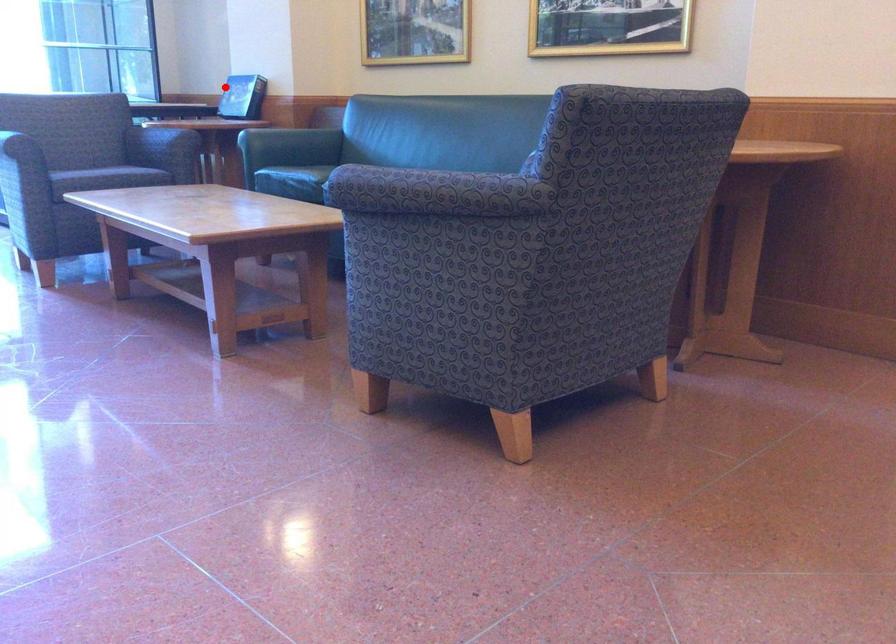
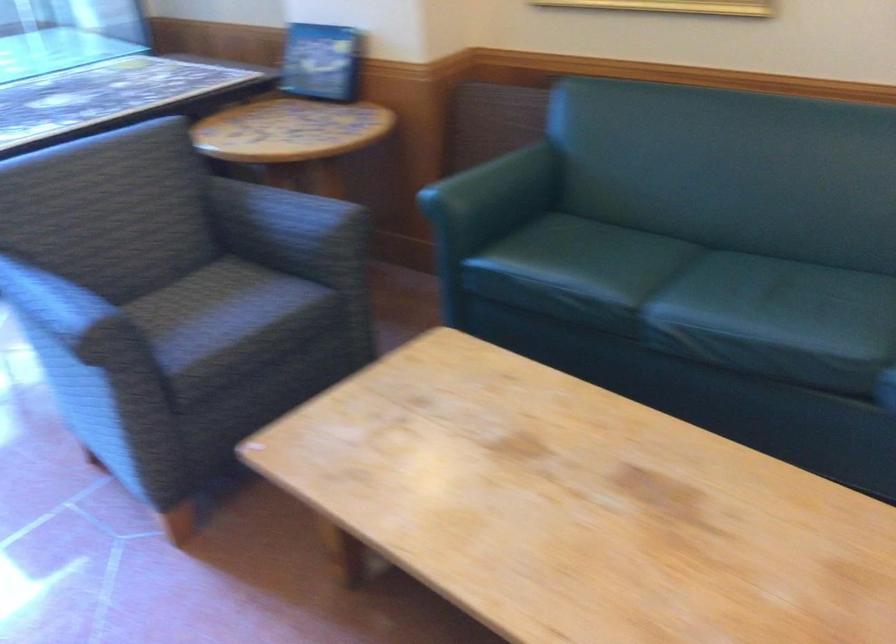
Locate, in the second image, the point that corresponds to the highlighted location in the first image.

(321, 62)